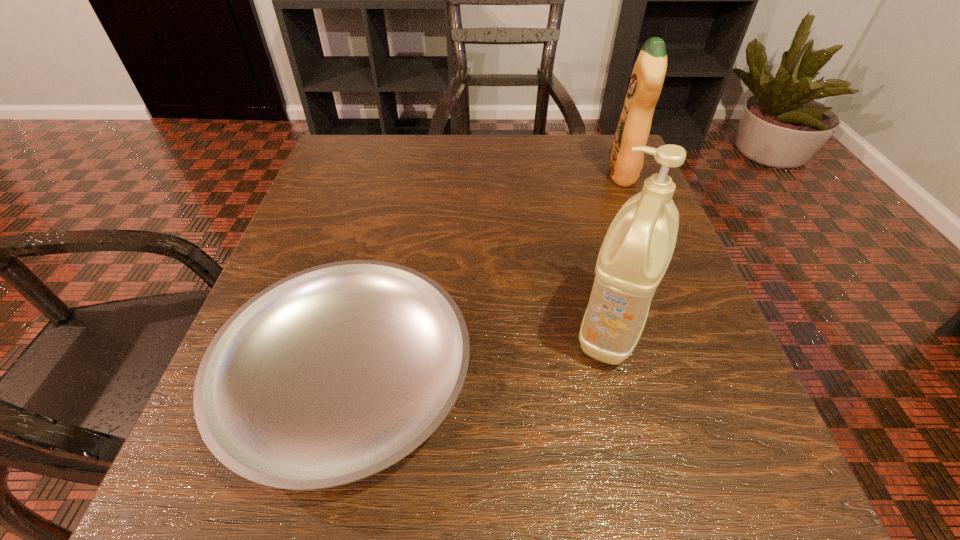
At what (x,y) coordinates should I click in order to perform the action: click on object that is the closest to the rightmost object. Please return your answer as a coordinate pair (x, y). The height and width of the screenshot is (540, 960). Looking at the image, I should click on (637, 249).

I want to click on vacant space that satisfies the following two spatial constraints: 1. on the label of the right detergent; 2. on the front side of the leftmost object, so tap(704, 379).

I want to click on free location that satisfies the following two spatial constraints: 1. on the back side of the nearer detergent; 2. on the left side of the leftmost object, so click(361, 329).

Where is `vacant area that satisfies the following two spatial constraints: 1. on the label of the right detergent; 2. on the front side of the leftmost object`? The height and width of the screenshot is (540, 960). vacant area that satisfies the following two spatial constraints: 1. on the label of the right detergent; 2. on the front side of the leftmost object is located at coordinates (704, 379).